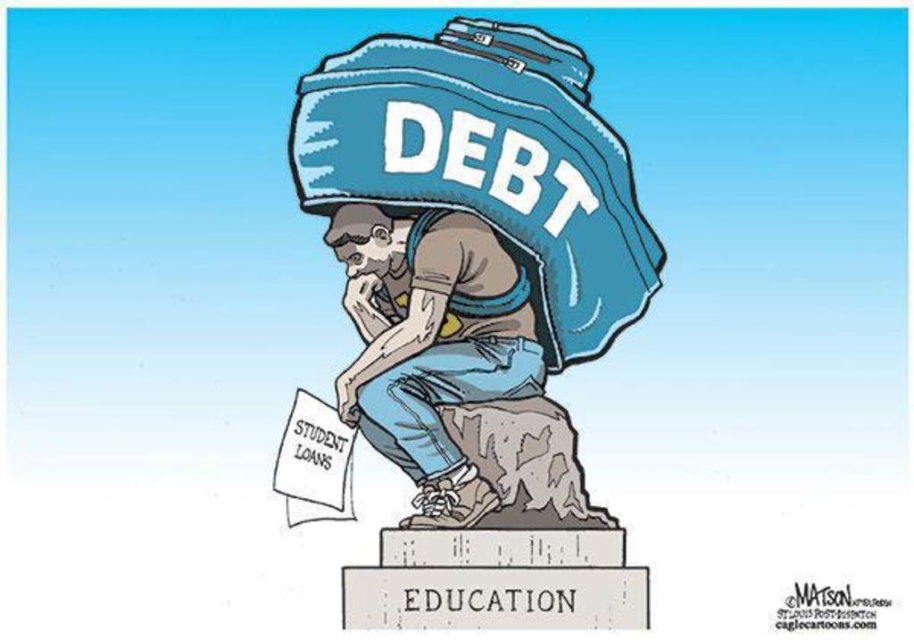
Question: Where is blue fabric bag at center located in relation to brown skin tone at center in the image?

Choices:
 (A) below
 (B) above

Answer: (B)

Question: Is blue fabric bag at center below brown skin tone at center?

Choices:
 (A) no
 (B) yes

Answer: (A)

Question: Which point appears farthest from the camera in this image?

Choices:
 (A) (626, 179)
 (B) (487, 484)

Answer: (A)

Question: Where is blue fabric bag at center located in relation to brown skin tone at center in the image?

Choices:
 (A) below
 (B) above

Answer: (B)

Question: Which object appears closest to the camera in this image?

Choices:
 (A) blue fabric bag at center
 (B) brown skin tone at center

Answer: (B)

Question: Among these objects, which one is nearest to the camera?

Choices:
 (A) blue fabric bag at center
 (B) brown skin tone at center

Answer: (B)